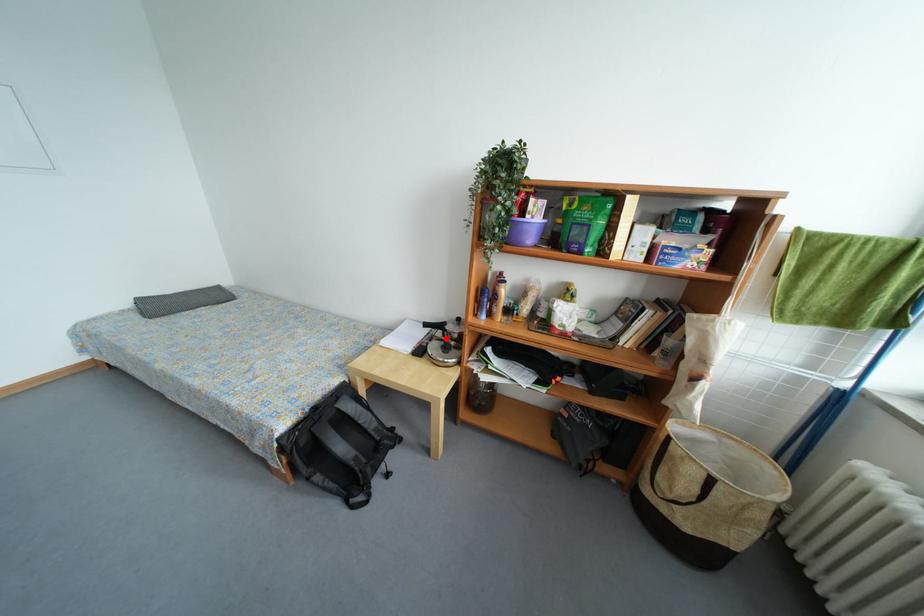
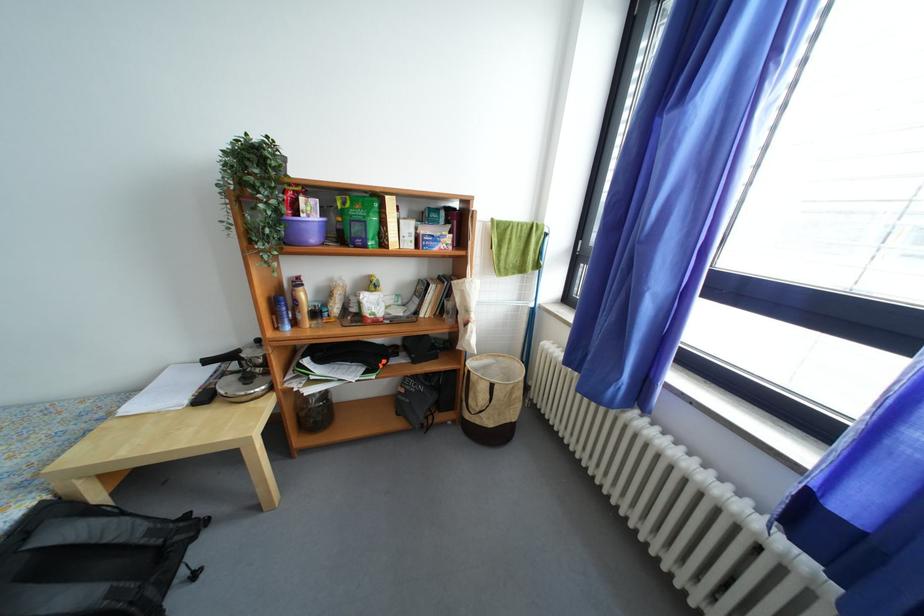
Question: I am providing you with two images of the same scene from different viewpoints. A red point is marked on the first image. Is the red point's position out of view in image 2?

Choices:
 (A) Yes
 (B) No

Answer: (B)